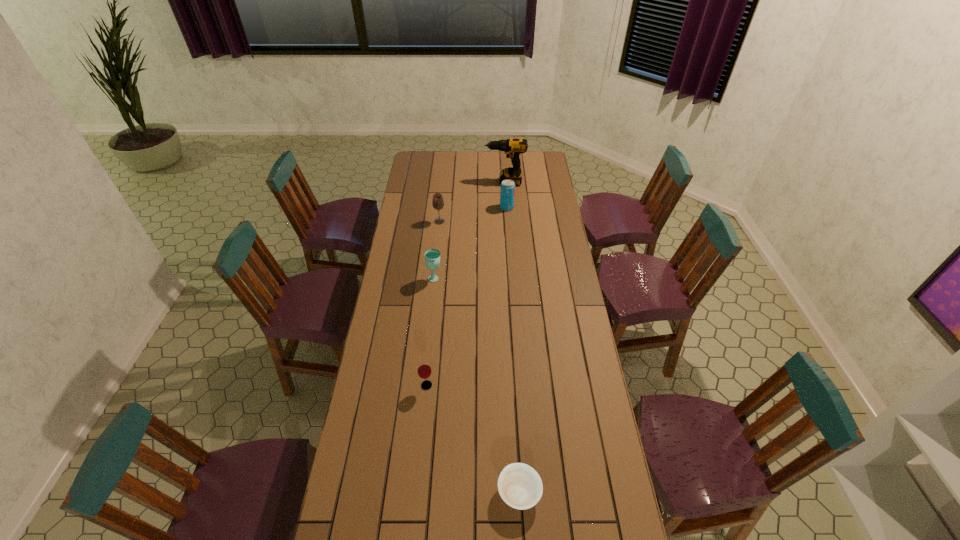
Locate which object is the closest to the fifth nearest object. Please provide its 2D coordinates. Your answer should be formatted as a tuple, i.e. [(x, y)], where the tuple contains the x and y coordinates of a point satisfying the conditions above.

[(513, 147)]

This screenshot has height=540, width=960. Identify the location of glass that stands as the closest to the bowl. (424, 370).

What are the coordinates of `glass that can be found as the third closest to the bowl` in the screenshot? It's located at (437, 202).

The width and height of the screenshot is (960, 540). I want to click on free location that satisfies the following two spatial constraints: 1. on the front side of the nearest glass; 2. on the right side of the fourth nearest object, so click(x=422, y=386).

You are a GUI agent. You are given a task and a screenshot of the screen. Output one action in this format:
    pyautogui.click(x=<x>, y=<y>)
    Task: Click on the free space that satisfies the following two spatial constraints: 1. on the front side of the shortest object; 2. on the right side of the fourth nearest object
    The height and width of the screenshot is (540, 960).
    Given the screenshot: What is the action you would take?
    pyautogui.click(x=411, y=492)

I want to click on vacant space that satisfies the following two spatial constraints: 1. at the tip of the soda can; 2. on the right side of the farthest object, so click(x=506, y=207).

In order to click on vacant region that satisfies the following two spatial constraints: 1. on the front side of the shortest glass; 2. on the left side of the nearest object in this screenshot , I will do `click(417, 492)`.